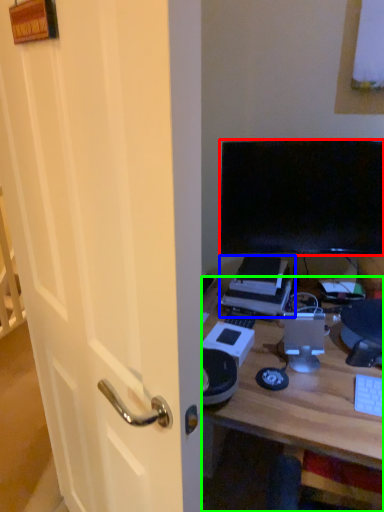
Question: Estimate the real-world distances between objects in this image. Which object is closer to television (highlighted by a red box), printer (highlighted by a blue box) or desk (highlighted by a green box)?

Choices:
 (A) printer
 (B) desk

Answer: (A)